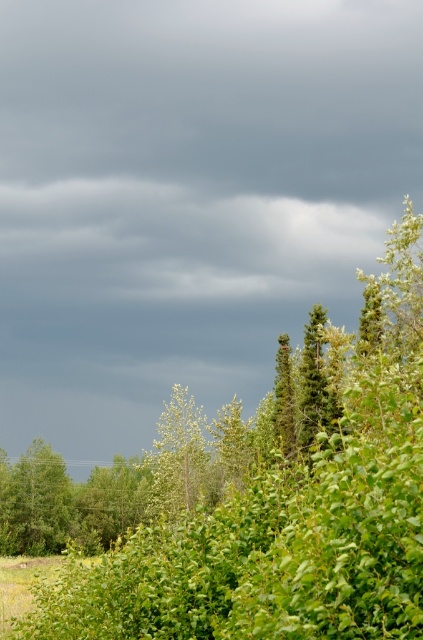
The height and width of the screenshot is (640, 423). What do you see at coordinates (286, 513) in the screenshot? I see `green leafy tree at upper center` at bounding box center [286, 513].

Does green leafy tree at upper center have a greater width compared to green leafy tree at lower left?

Correct, the width of green leafy tree at upper center exceeds that of green leafy tree at lower left.

Where is `green leafy tree at upper center`? This screenshot has height=640, width=423. green leafy tree at upper center is located at coordinates (286, 513).

Where is `green leafy tree at upper center`? green leafy tree at upper center is located at coordinates (286, 513).

Who is positioned more to the right, green leafy tree at lower left or green leafy tree at center?

green leafy tree at center is more to the right.

Does point (63, 499) come in front of point (175, 444)?

No, it is not.

Identify the location of green leafy tree at lower left. (35, 502).

Is point (395, 563) farther from camera compared to point (180, 403)?

No.

Is green leafy tree at upper center smaller than green leafy tree at center?

Incorrect, green leafy tree at upper center is not smaller in size than green leafy tree at center.

This screenshot has width=423, height=640. I want to click on green leafy tree at upper center, so click(x=286, y=513).